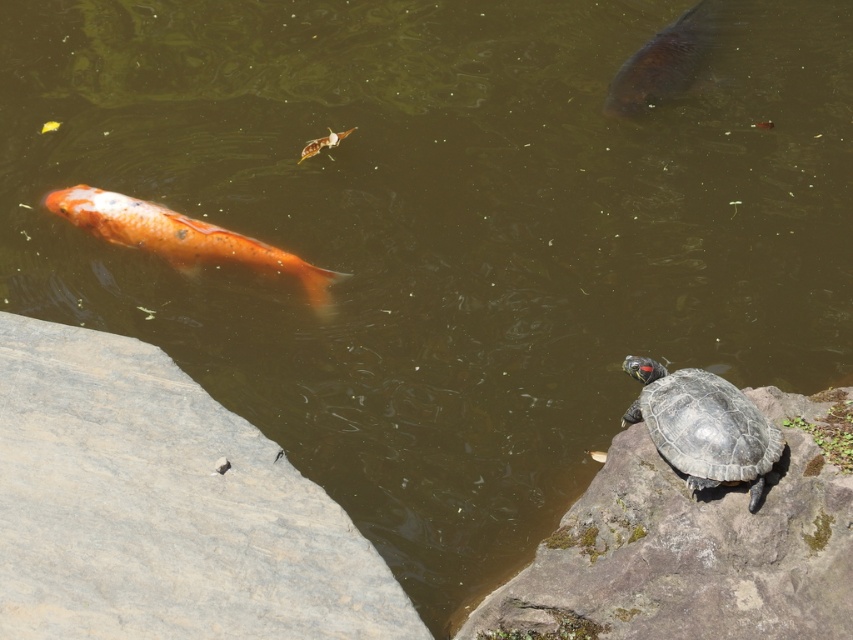
Question: Which point is farther to the camera?

Choices:
 (A) (160, 504)
 (B) (312, 148)
 (C) (663, 84)

Answer: (C)

Question: Does shiny brown fish at upper right appear over shiny orange fish at upper center?

Choices:
 (A) yes
 (B) no

Answer: (A)

Question: Can you confirm if orange matte fish at left is bigger than shiny brown fish at upper right?

Choices:
 (A) no
 (B) yes

Answer: (A)

Question: Which of the following is the farthest from the observer?

Choices:
 (A) gray/mossy rock at lower right
 (B) orange matte fish at left

Answer: (B)

Question: Is gray stone at lower left to the left of shiny orange fish at upper center from the viewer's perspective?

Choices:
 (A) yes
 (B) no

Answer: (A)

Question: Which point appears farthest from the camera in this image?

Choices:
 (A) (704, 44)
 (B) (299, 259)
 (C) (643, 516)

Answer: (A)